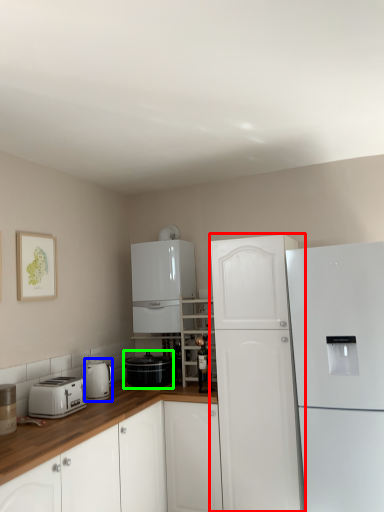
Question: Based on their relative distances, which object is farther from refrigerator (highlighted by a red box)? Choose from kitchen appliance (highlighted by a blue box) and kitchen appliance (highlighted by a green box).

Choices:
 (A) kitchen appliance
 (B) kitchen appliance

Answer: (A)